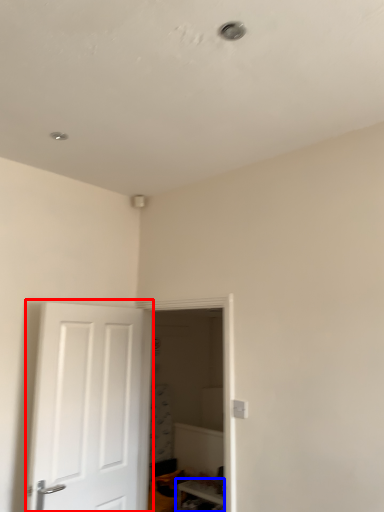
Question: Which object is closer to the camera taking this photo, door (highlighted by a red box) or furniture (highlighted by a blue box)?

Choices:
 (A) door
 (B) furniture

Answer: (A)